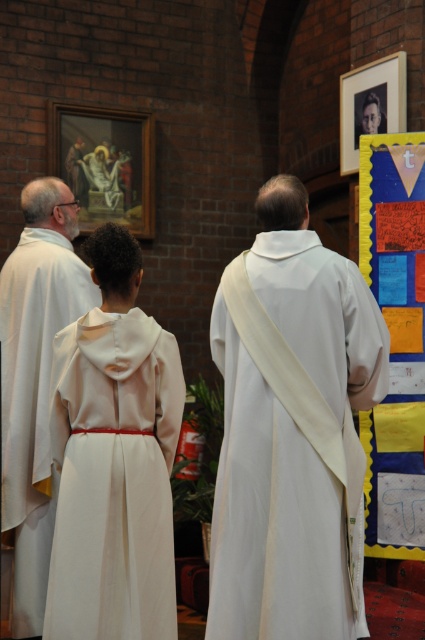
You are a photographer setting up for a group photo. You need to position a light source so that it illuminates both the white matte dress at center and the white matte robe at left without casting shadows on the brick wall behind them. Given their positions, which object should be placed closer to the light source to achieve even lighting?

The white matte dress at center should be placed closer to the light source because it is positioned below the white matte robe at left. Since it is lower, moving it closer ensures both receive similar lighting intensity.

You are organizing a photo shoot and need to ensure that the white clothed man at center and the white matte dress at center are clearly visible in the frame. Given their sizes, which one might require more space to avoid being cropped out?

The white clothed man at center is larger in size than the white matte dress at center, so he would require more space to avoid being cropped out.

You are standing in the room and want to greet the white clothed man at center. Which direction should you move to approach him?

Result: Since the white clothed man at center is located at point 0.685 on the y axis, you should move forward to approach him because he is in front of you.